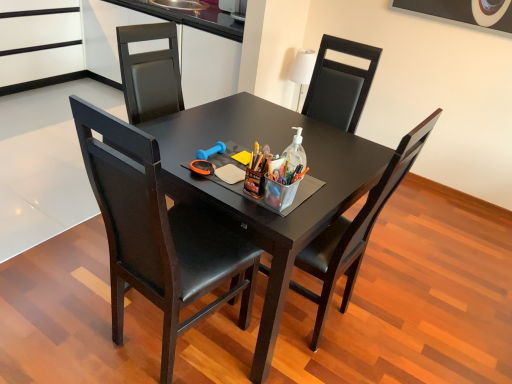
Identify the location of free spot to the left of translucent plastic bottle at center. (231, 161).